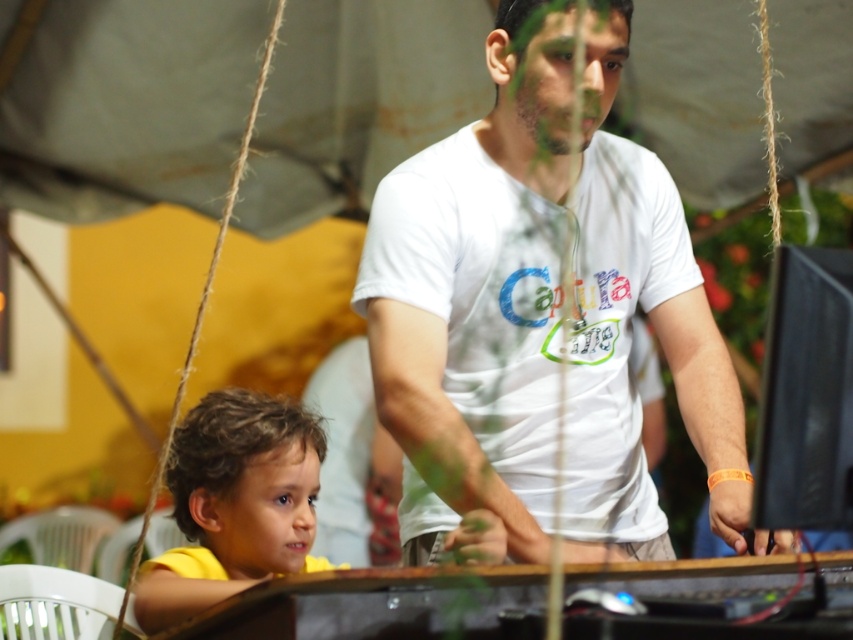
Does smooth brown hair at lower left appear under matte white face at center?

Correct, smooth brown hair at lower left is located below matte white face at center.

Looking at this image, can you confirm if smooth brown hair at lower left is smaller than matte white face at center?

No, smooth brown hair at lower left is not smaller than matte white face at center.

Who is more distant from viewer, (289, 540) or (601, 116)?

Point (289, 540)

You are a GUI agent. You are given a task and a screenshot of the screen. Output one action in this format:
    pyautogui.click(x=<x>, y=<y>)
    Task: Click on the smooth brown hair at lower left
    
    Given the screenshot: What is the action you would take?
    pyautogui.click(x=263, y=513)

In order to click on white cotton t-shirt at center in this screenshot , I will do [541, 312].

Is point (502, 60) less distant than point (236, 493)?

Yes, it is.

Which is behind, point (372, 369) or point (248, 481)?

The point (248, 481) is more distant.

You are a GUI agent. You are given a task and a screenshot of the screen. Output one action in this format:
    pyautogui.click(x=<x>, y=<y>)
    Task: Click on the white cotton t-shirt at center
    This screenshot has height=640, width=853.
    Given the screenshot: What is the action you would take?
    pyautogui.click(x=541, y=312)

The height and width of the screenshot is (640, 853). What do you see at coordinates (234, 502) in the screenshot? I see `yellow matte shirt at lower left` at bounding box center [234, 502].

Measure the distance between yellow matte shirt at lower left and camera.

The distance of yellow matte shirt at lower left from camera is 8.06 feet.

Which is in front, point (219, 467) or point (505, 17)?

Point (505, 17)

The image size is (853, 640). Find the location of `yellow matte shirt at lower left`. yellow matte shirt at lower left is located at coordinates (234, 502).